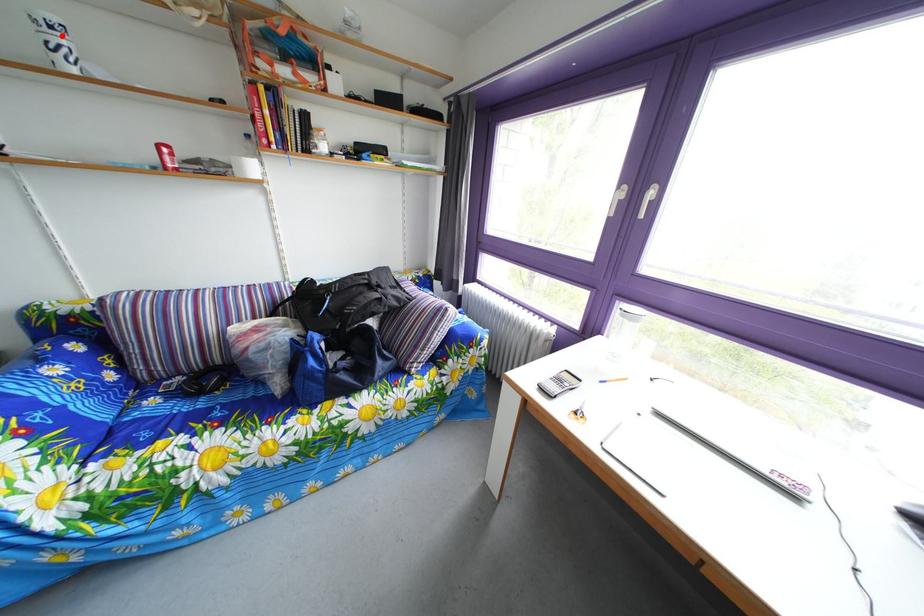
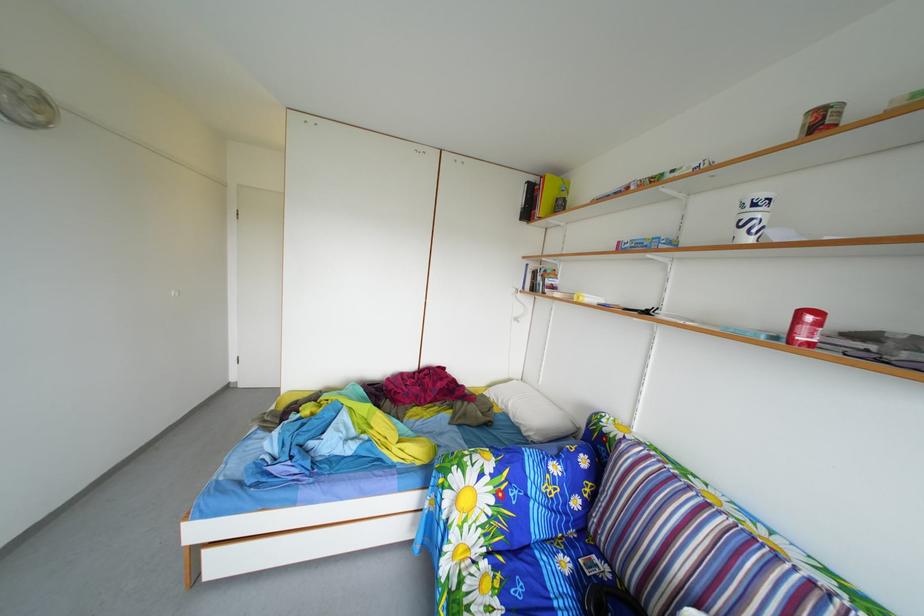
Find the pixel in the second image that matches the highlighted location in the first image.

(766, 214)